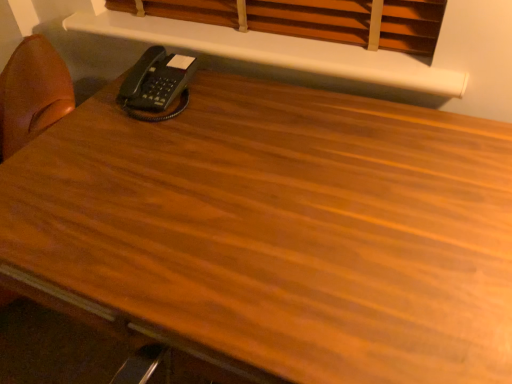
Question: Is the position of white matte shelf at upper center less distant than that of black plastic phone at upper left?

Choices:
 (A) yes
 (B) no

Answer: (A)

Question: Considering the relative positions of white matte shelf at upper center and black plastic phone at upper left in the image provided, is white matte shelf at upper center to the left of black plastic phone at upper left from the viewer's perspective?

Choices:
 (A) no
 (B) yes

Answer: (A)

Question: Is black plastic phone at upper left completely or partially inside white matte shelf at upper center?

Choices:
 (A) yes
 (B) no

Answer: (B)

Question: Is the depth of white matte shelf at upper center greater than that of black plastic phone at upper left?

Choices:
 (A) no
 (B) yes

Answer: (A)

Question: Is white matte shelf at upper center with black plastic phone at upper left?

Choices:
 (A) no
 (B) yes

Answer: (A)

Question: Considering the positions of point (181, 87) and point (358, 64), is point (181, 87) closer or farther from the camera than point (358, 64)?

Choices:
 (A) farther
 (B) closer

Answer: (A)

Question: Would you say black plastic phone at upper left is inside or outside white matte shelf at upper center?

Choices:
 (A) inside
 (B) outside

Answer: (B)

Question: From the image's perspective, is black plastic phone at upper left above or below white matte shelf at upper center?

Choices:
 (A) below
 (B) above

Answer: (A)

Question: Is black plastic phone at upper left wider or thinner than white matte shelf at upper center?

Choices:
 (A) thin
 (B) wide

Answer: (B)

Question: In terms of height, does wooden blinds at upper center look taller or shorter compared to black plastic phone at upper left?

Choices:
 (A) short
 (B) tall

Answer: (B)

Question: Considering the positions of point (314, 14) and point (143, 97), is point (314, 14) closer or farther from the camera than point (143, 97)?

Choices:
 (A) closer
 (B) farther

Answer: (B)

Question: Looking at their shapes, would you say wooden blinds at upper center is wider or thinner than black plastic phone at upper left?

Choices:
 (A) wide
 (B) thin

Answer: (B)

Question: Considering their positions, is wooden blinds at upper center located in front of or behind black plastic phone at upper left?

Choices:
 (A) front
 (B) behind

Answer: (A)

Question: Based on their positions, is wooden blinds at upper center located to the left or right of white matte shelf at upper center?

Choices:
 (A) left
 (B) right

Answer: (B)

Question: Does point (326, 38) appear closer or farther from the camera than point (283, 59)?

Choices:
 (A) farther
 (B) closer

Answer: (A)